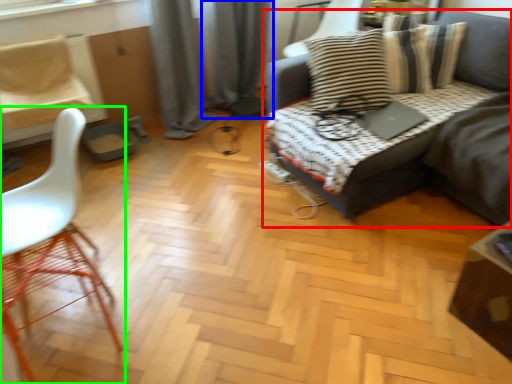
Question: Which is nearer to the studio couch (highlighted by a red box)? curtain (highlighted by a blue box) or chair (highlighted by a green box).

Choices:
 (A) curtain
 (B) chair

Answer: (A)